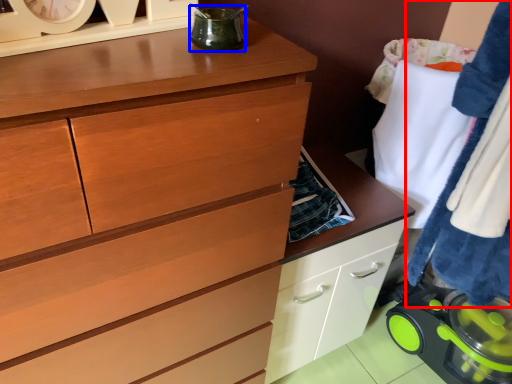
Question: Among these objects, which one is nearest to the camera, clothing (highlighted by a red box) or appliance (highlighted by a blue box)?

Choices:
 (A) clothing
 (B) appliance

Answer: (B)